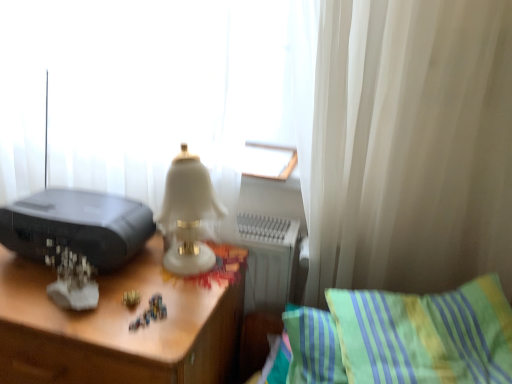
Question: Does white sheer curtain at upper left come behind black plastic printer at left?

Choices:
 (A) no
 (B) yes

Answer: (A)

Question: Is white sheer curtain at upper left turned away from black plastic printer at left?

Choices:
 (A) no
 (B) yes

Answer: (B)

Question: Can you confirm if white sheer curtain at upper left is shorter than black plastic printer at left?

Choices:
 (A) no
 (B) yes

Answer: (A)

Question: Can you confirm if white sheer curtain at upper left is wider than black plastic printer at left?

Choices:
 (A) no
 (B) yes

Answer: (B)

Question: Does white sheer curtain at upper left have a smaller size compared to black plastic printer at left?

Choices:
 (A) yes
 (B) no

Answer: (B)

Question: Is white sheer curtain at upper left thinner than black plastic printer at left?

Choices:
 (A) yes
 (B) no

Answer: (B)

Question: Is white sheer curtain at upper left placed right next to wooden desk at center?

Choices:
 (A) no
 (B) yes

Answer: (A)

Question: Considering the relative sizes of white sheer curtain at upper left and wooden desk at center in the image provided, is white sheer curtain at upper left smaller than wooden desk at center?

Choices:
 (A) yes
 (B) no

Answer: (B)

Question: Could you tell me if white sheer curtain at upper left is facing wooden desk at center?

Choices:
 (A) yes
 (B) no

Answer: (A)

Question: From a real-world perspective, is white sheer curtain at upper left over wooden desk at center?

Choices:
 (A) no
 (B) yes

Answer: (B)

Question: Is white sheer curtain at upper left taller than wooden desk at center?

Choices:
 (A) yes
 (B) no

Answer: (A)

Question: From the image's perspective, does white sheer curtain at upper left appear higher than wooden desk at center?

Choices:
 (A) no
 (B) yes

Answer: (B)

Question: Can you confirm if black plastic printer at left is bigger than green striped pillow at lower right?

Choices:
 (A) yes
 (B) no

Answer: (B)